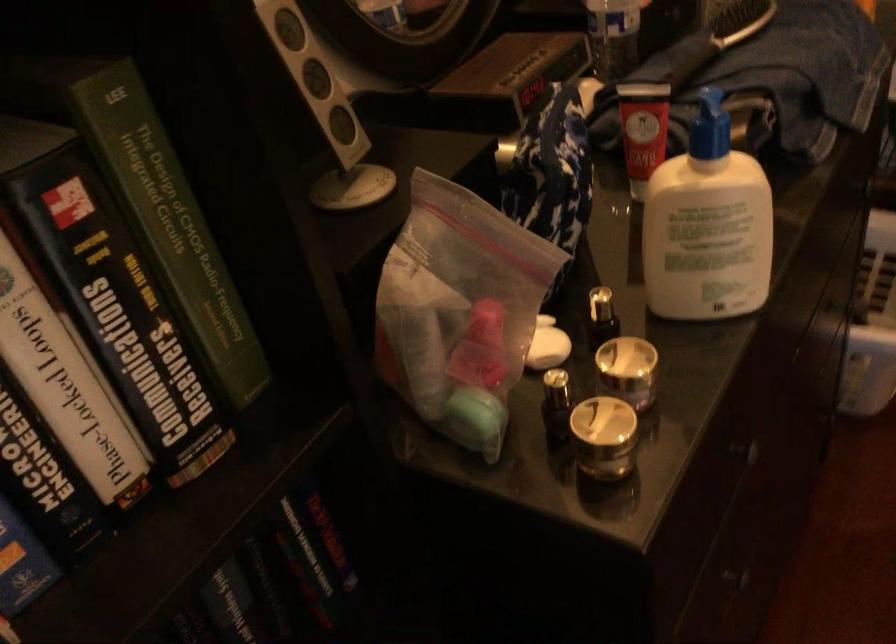
What do you see at coordinates (709, 126) in the screenshot? The image size is (896, 644). I see `the blue pump dispenser` at bounding box center [709, 126].